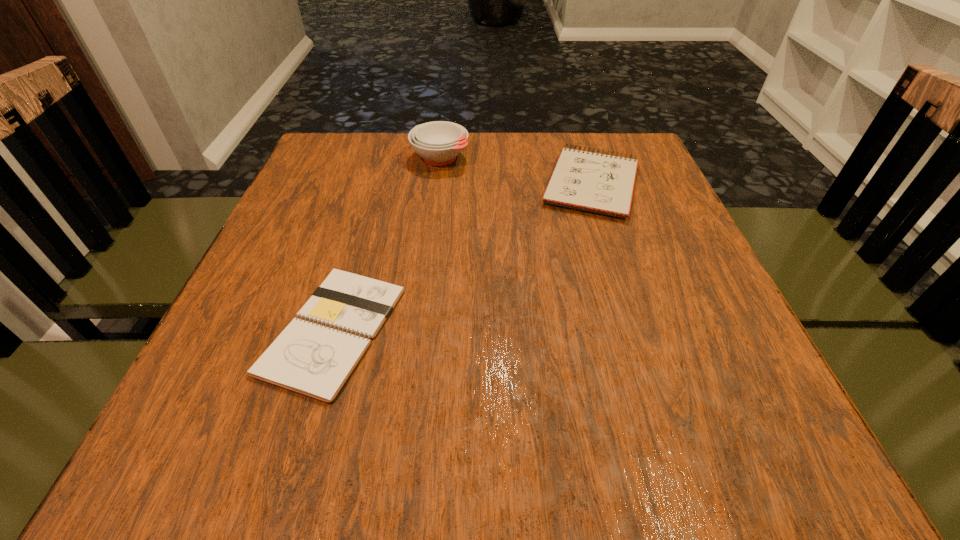
The image size is (960, 540). Identify the location of free spot between the soup bowl and the second shortest object. (516, 171).

Where is `vacant space in between the left notepad and the tallest object`? This screenshot has height=540, width=960. vacant space in between the left notepad and the tallest object is located at coordinates (387, 244).

Where is `free spot between the tallest object and the second tallest object`? The width and height of the screenshot is (960, 540). free spot between the tallest object and the second tallest object is located at coordinates tap(516, 171).

Find the location of a particular element. The width and height of the screenshot is (960, 540). vacant space that's between the left notepad and the second shortest object is located at coordinates (463, 257).

At what (x,y) coordinates should I click in order to perform the action: click on vacant area that lies between the shortest object and the soup bowl. Please return your answer as a coordinate pair (x, y). This screenshot has width=960, height=540. Looking at the image, I should click on (387, 244).

Locate an element on the screen. This screenshot has height=540, width=960. vacant space that's between the nearer notepad and the farther notepad is located at coordinates (463, 257).

At what (x,y) coordinates should I click in order to perform the action: click on vacant area that lies between the farther notepad and the soup bowl. Please return your answer as a coordinate pair (x, y). This screenshot has width=960, height=540. Looking at the image, I should click on (516, 171).

Where is `vacant area that lies between the left notepad and the tallest object`? Image resolution: width=960 pixels, height=540 pixels. vacant area that lies between the left notepad and the tallest object is located at coordinates (387, 244).

Locate an element on the screen. This screenshot has height=540, width=960. free space between the rightmost object and the shorter notepad is located at coordinates (463, 257).

The height and width of the screenshot is (540, 960). Identify the location of object that ranks as the second closest to the left notepad. (439, 142).